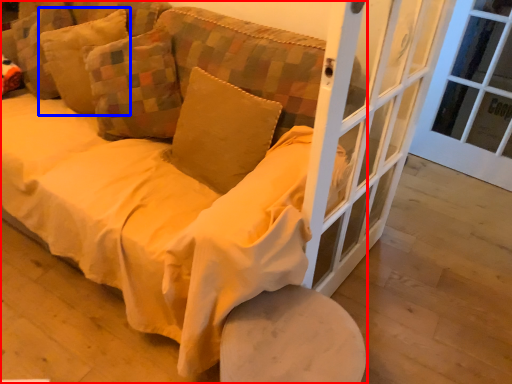
Question: Which point is further to the camera, studio couch (highlighted by a red box) or pillow (highlighted by a blue box)?

Choices:
 (A) studio couch
 (B) pillow

Answer: (B)